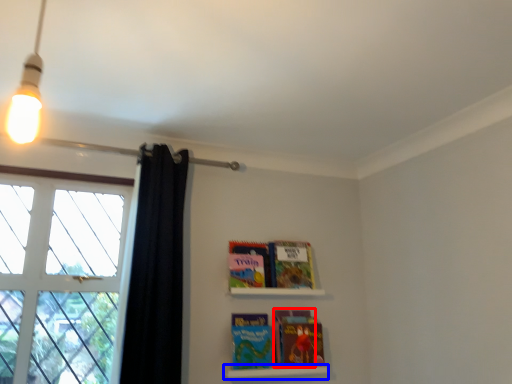
Question: Which of the following is the closest to the observer, paperback book (highlighted by a red box) or shelf (highlighted by a blue box)?

Choices:
 (A) paperback book
 (B) shelf

Answer: (B)